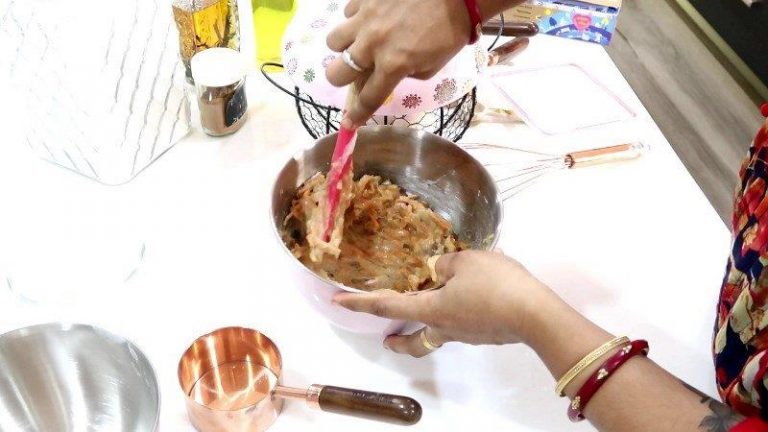
Identify the location of measuring cup. The width and height of the screenshot is (768, 432). (233, 374).